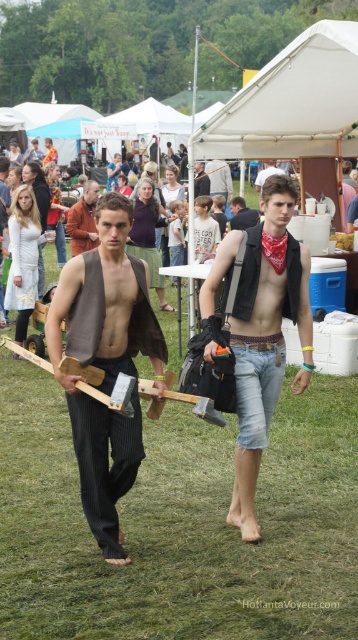
Measure the distance from denim shorts at center to brown leather jacket at center.

The distance of denim shorts at center from brown leather jacket at center is 20.27 feet.

Is denim shorts at center wider than brown leather jacket at center?

Correct, the width of denim shorts at center exceeds that of brown leather jacket at center.

Is point (265, 266) positioned in front of point (86, 248)?

Yes, point (265, 266) is in front of point (86, 248).

What are the coordinates of `denim shorts at center` in the screenshot? It's located at (265, 337).

Between brown leather jacket at center and denim vest at center, which one appears on the left side from the viewer's perspective?

brown leather jacket at center

Is brown leather jacket at center above denim vest at center?

No, brown leather jacket at center is not above denim vest at center.

Is point (90, 218) positioned behind point (250, 221)?

No.

At what (x,y) coordinates should I click in order to perform the action: click on brown leather jacket at center. Please return your answer as a coordinate pair (x, y). Image resolution: width=358 pixels, height=640 pixels. Looking at the image, I should click on (84, 220).

Between point (128, 202) and point (258, 220), which one is positioned in front?

Point (128, 202) is more forward.

What do you see at coordinates (105, 364) in the screenshot? The image size is (358, 640). I see `matte brown vest at center` at bounding box center [105, 364].

The width and height of the screenshot is (358, 640). In order to click on matte brown vest at center in this screenshot , I will do `click(105, 364)`.